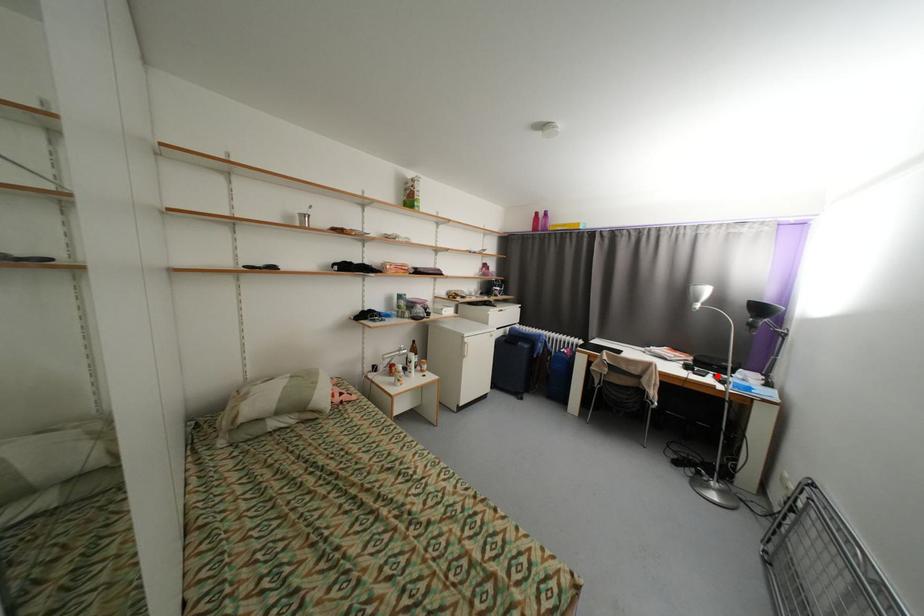
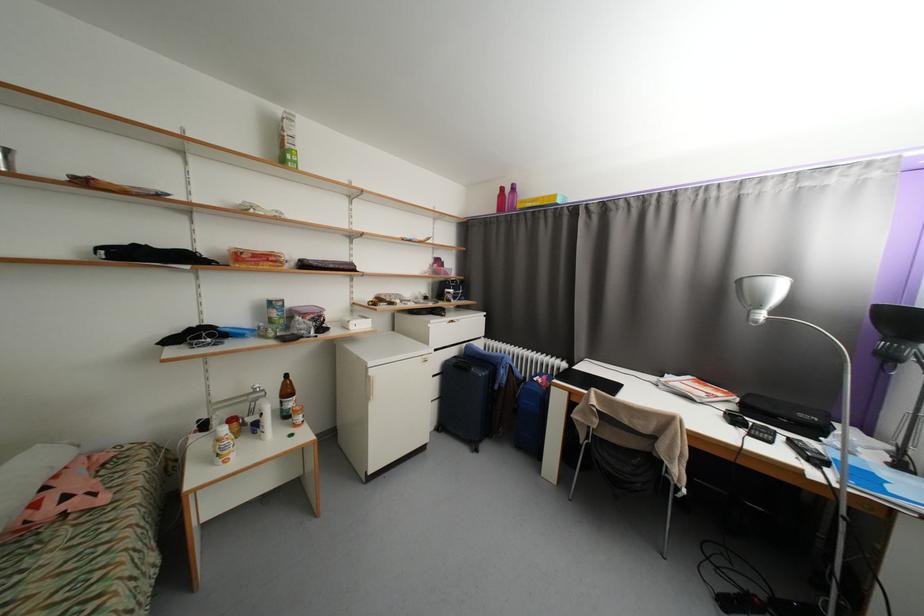
In the second image, find the point that corresponds to the highlighted location in the first image.

(787, 439)